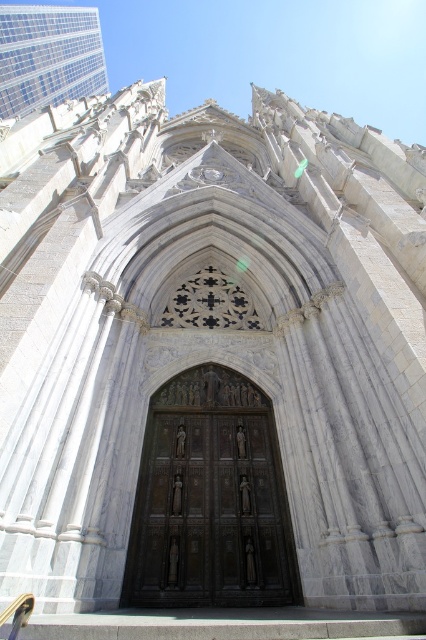
Consider the image. Does dark brown wood at center have a larger size compared to matte gray stone church at upper left?

No, dark brown wood at center is not bigger than matte gray stone church at upper left.

Does point (146, 454) come farther from viewer compared to point (6, 10)?

No, it is in front of (6, 10).

Is point (152, 500) in front of point (17, 22)?

Yes.

This screenshot has height=640, width=426. Find the location of `dark brown wood at center`. dark brown wood at center is located at coordinates [210, 515].